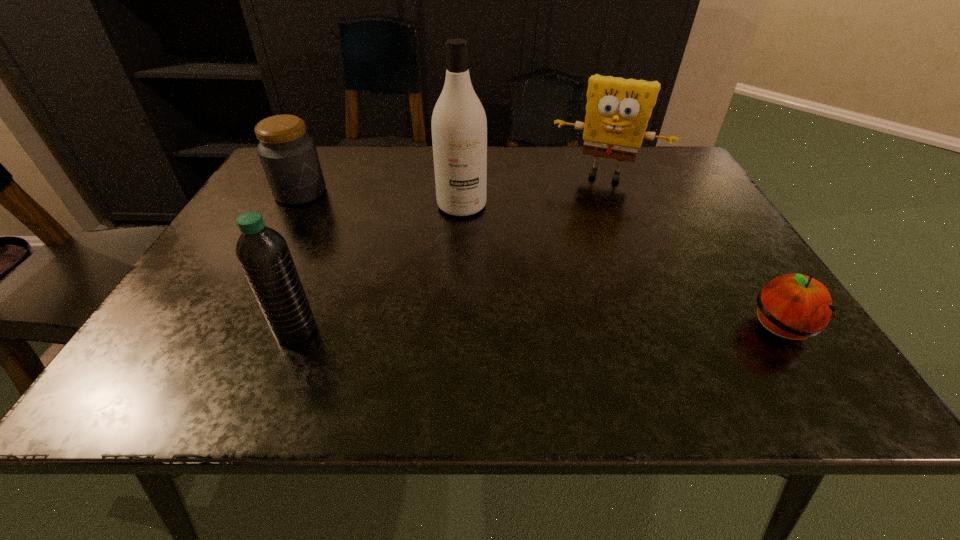
Find the location of `free space located 0.080m on the front-facing side of the shampoo`. free space located 0.080m on the front-facing side of the shampoo is located at coordinates (466, 241).

Locate an element on the screen. Image resolution: width=960 pixels, height=540 pixels. vacant space located on the front-facing side of the shampoo is located at coordinates (475, 333).

In order to click on free space located 0.340m on the front-facing side of the shampoo in this screenshot , I will do `click(475, 329)`.

Identify the location of free spot located on the surface of the jar near the warning symbol. (364, 238).

Where is `free space located 0.290m on the surface of the jar near the warning symbol`? The height and width of the screenshot is (540, 960). free space located 0.290m on the surface of the jar near the warning symbol is located at coordinates (386, 253).

The width and height of the screenshot is (960, 540). I want to click on vacant space located on the surface of the jar near the warning symbol, so click(x=329, y=213).

What are the coordinates of `vacant region located 0.130m on the face of the sponge` in the screenshot? It's located at (582, 214).

Locate an element on the screen. The width and height of the screenshot is (960, 540). vacant area located 0.170m on the face of the sponge is located at coordinates point(579,223).

Identify the location of free space located 0.180m on the face of the sponge. (578, 225).

Where is `jar present at the far edge`? jar present at the far edge is located at coordinates (289, 158).